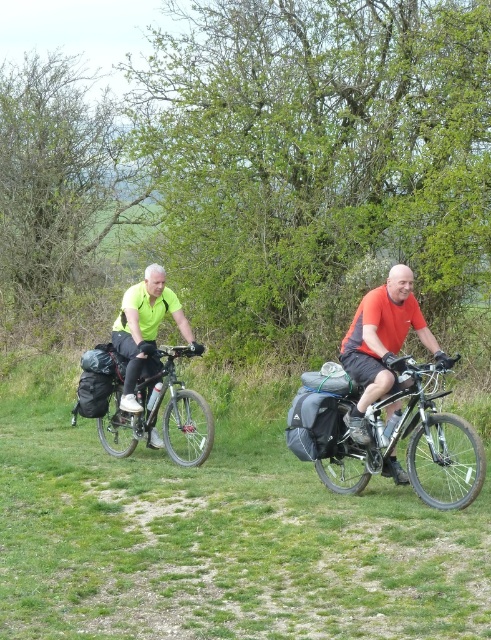
Question: Which object appears farthest from the camera in this image?

Choices:
 (A) green grass at center
 (B) shiny metallic bicycle at center

Answer: (B)

Question: Does matte orange shirt at center appear on the right side of silver metallic bicycle at center-left?

Choices:
 (A) no
 (B) yes

Answer: (B)

Question: Which object appears farthest from the camera in this image?

Choices:
 (A) green grass at center
 (B) silver metallic bicycle at center-left

Answer: (B)

Question: Does matte orange shirt at center have a lesser width compared to neon yellow jersey at center?

Choices:
 (A) no
 (B) yes

Answer: (B)

Question: Where is silver metallic bicycle at center-left located in relation to neon yellow jersey at center in the image?

Choices:
 (A) right
 (B) left

Answer: (A)

Question: Which point is farther to the camera?

Choices:
 (A) silver metallic bicycle at center-left
 (B) neon yellow jersey at center
 (C) green grass at center
 (D) matte orange shirt at center

Answer: (B)